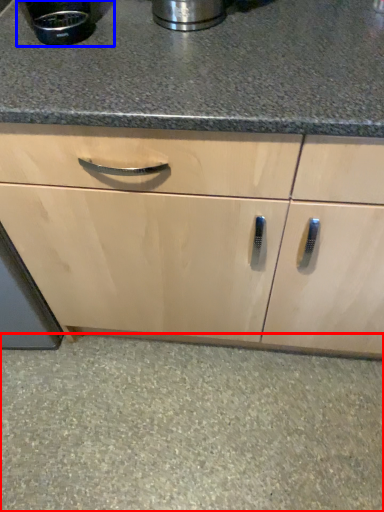
Question: Among these objects, which one is nearest to the camera, granite (highlighted by a red box) or appliance (highlighted by a blue box)?

Choices:
 (A) granite
 (B) appliance

Answer: (B)